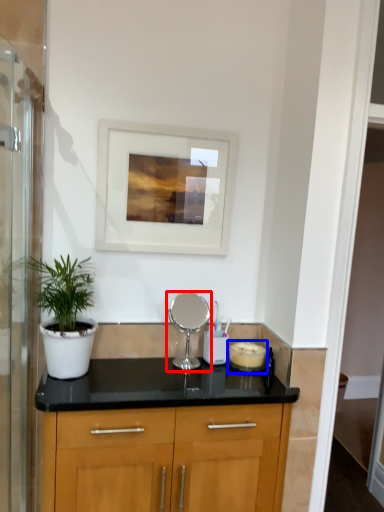
Question: Which point is closer to the camera, appliance (highlighted by a red box) or appliance (highlighted by a blue box)?

Choices:
 (A) appliance
 (B) appliance

Answer: (A)